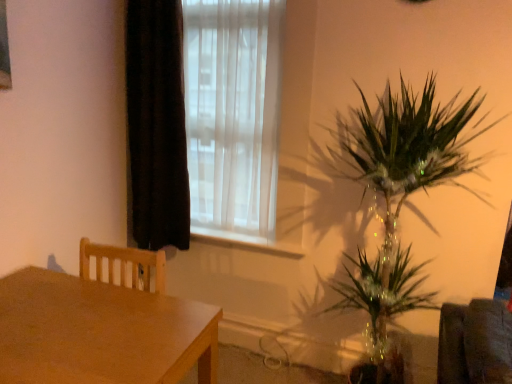
This screenshot has width=512, height=384. What are the coordinates of `empty space that is ontop of white plastic window sill at center (from a real-world perspective)` in the screenshot? It's located at (229, 230).